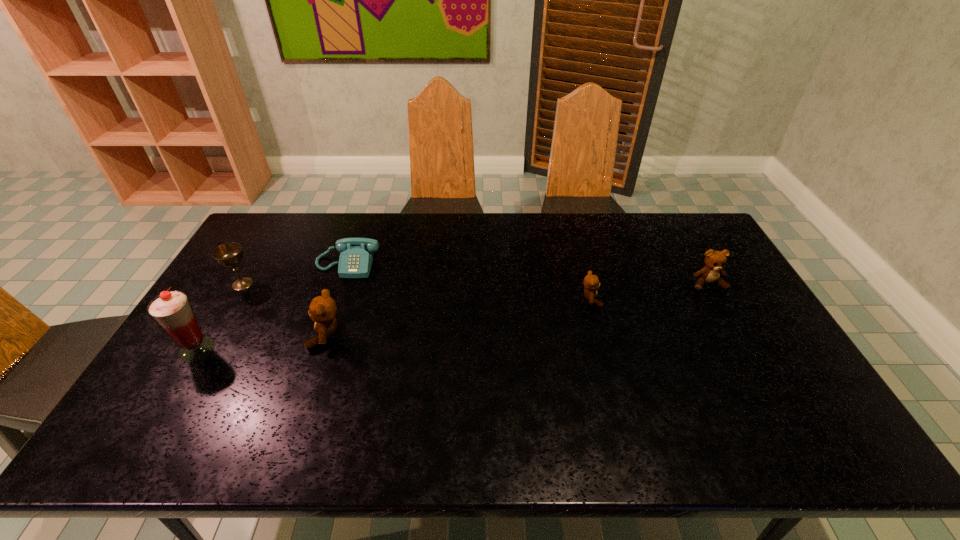
Image resolution: width=960 pixels, height=540 pixels. What are the coordinates of `free location that satisfies the following two spatial constraints: 1. on the front-facing side of the nearest teddy bear; 2. on the front side of the smoothie` in the screenshot? It's located at (322, 349).

Identify the location of blank space that satisfies the following two spatial constraints: 1. on the back side of the smoothie; 2. on the left side of the chalice. This screenshot has width=960, height=540. (237, 284).